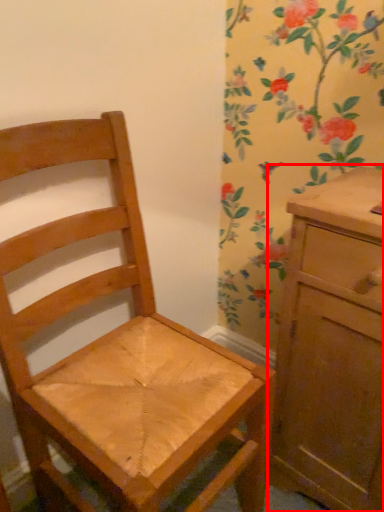
Question: Observing the image, what is the correct spatial positioning of chest of drawers (annotated by the red box) in reference to chair?

Choices:
 (A) left
 (B) right

Answer: (B)